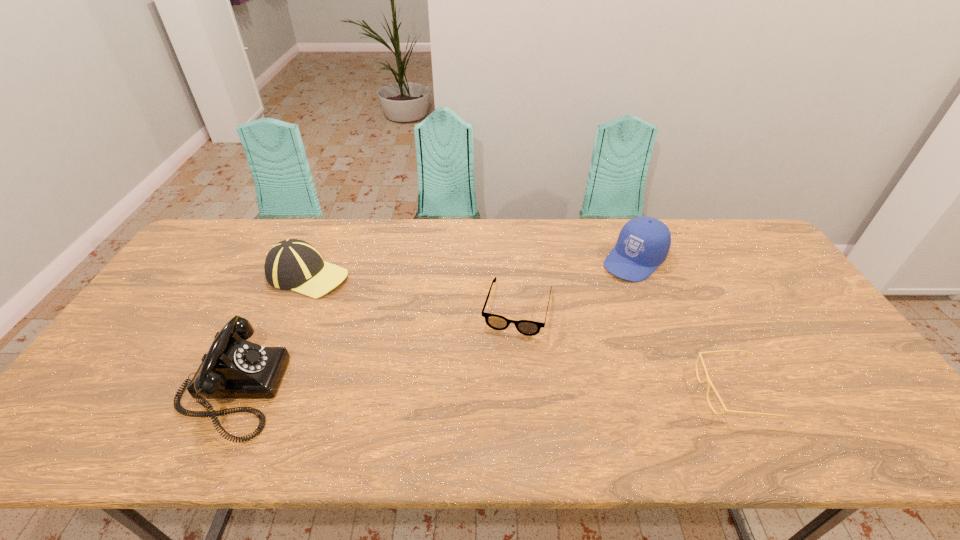
The width and height of the screenshot is (960, 540). I want to click on telephone, so click(x=233, y=367).

Where is `the right spectacles`? The width and height of the screenshot is (960, 540). the right spectacles is located at coordinates (707, 379).

At what (x,y) coordinates should I click in order to perform the action: click on cap. Please return your answer as a coordinate pair (x, y). Image resolution: width=960 pixels, height=540 pixels. Looking at the image, I should click on (643, 243).

You are a GUI agent. You are given a task and a screenshot of the screen. Output one action in this format:
    pyautogui.click(x=<x>, y=<y>)
    Task: Click on the third shortest object
    This screenshot has height=540, width=960.
    Given the screenshot: What is the action you would take?
    pyautogui.click(x=292, y=264)

This screenshot has width=960, height=540. Find the location of `the farther spectacles`. the farther spectacles is located at coordinates (526, 327).

You are a GUI agent. You are given a task and a screenshot of the screen. Output one action in this format:
    pyautogui.click(x=<x>, y=<y>)
    Task: Click on the left spectacles
    This screenshot has width=960, height=540.
    Given the screenshot: What is the action you would take?
    pyautogui.click(x=526, y=327)

Identify the location of free space located 0.380m on the dial of the telephone. This screenshot has height=540, width=960. pyautogui.click(x=436, y=390).

Identify the location of free location located in front of the lenses of the nearer spectacles. (553, 392).

The height and width of the screenshot is (540, 960). I want to click on vacant space situated in front of the lenses of the nearer spectacles, so click(611, 392).

At what (x,y) coordinates should I click in order to perform the action: click on free space located in front of the lenses of the nearer spectacles. Please return your answer as a coordinate pair (x, y). Looking at the image, I should click on (636, 392).